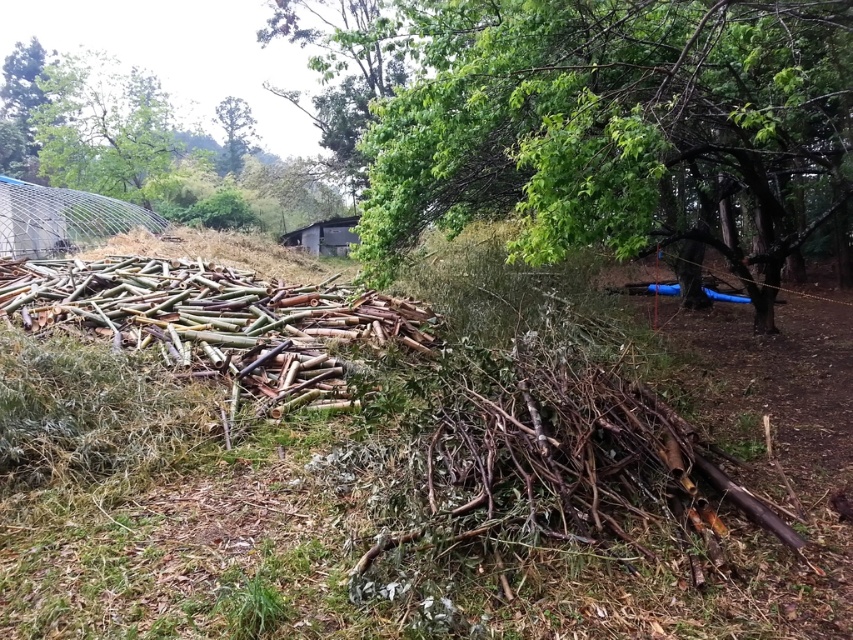
Is green leafy tree at center wider than green leafy tree at upper center?

No.

Who is shorter, green leafy tree at center or green leafy tree at upper center?

Standing shorter between the two is green leafy tree at center.

In order to click on green leafy tree at center in this screenshot , I will do 619,131.

This screenshot has width=853, height=640. What are the coordinates of `green leafy tree at center` in the screenshot? It's located at (619, 131).

Is green leafy tree at upper left taller than green leafy tree at upper center?

Indeed, green leafy tree at upper left has a greater height compared to green leafy tree at upper center.

Which of these two, green leafy tree at upper left or green leafy tree at upper center, stands taller?

Standing taller between the two is green leafy tree at upper left.

Does point (79, 97) lie in front of point (221, 125)?

Yes, it is.

You are a GUI agent. You are given a task and a screenshot of the screen. Output one action in this format:
    pyautogui.click(x=<x>, y=<y>)
    Task: Click on the green leafy tree at upper left
    This screenshot has height=640, width=853.
    Given the screenshot: What is the action you would take?
    pyautogui.click(x=103, y=129)

Can you confirm if green leafy tree at center is smaller than green leafy tree at upper left?

Yes.

Where is `green leafy tree at center`? green leafy tree at center is located at coordinates (619, 131).

Locate an element on the screen. The height and width of the screenshot is (640, 853). green leafy tree at center is located at coordinates (619, 131).